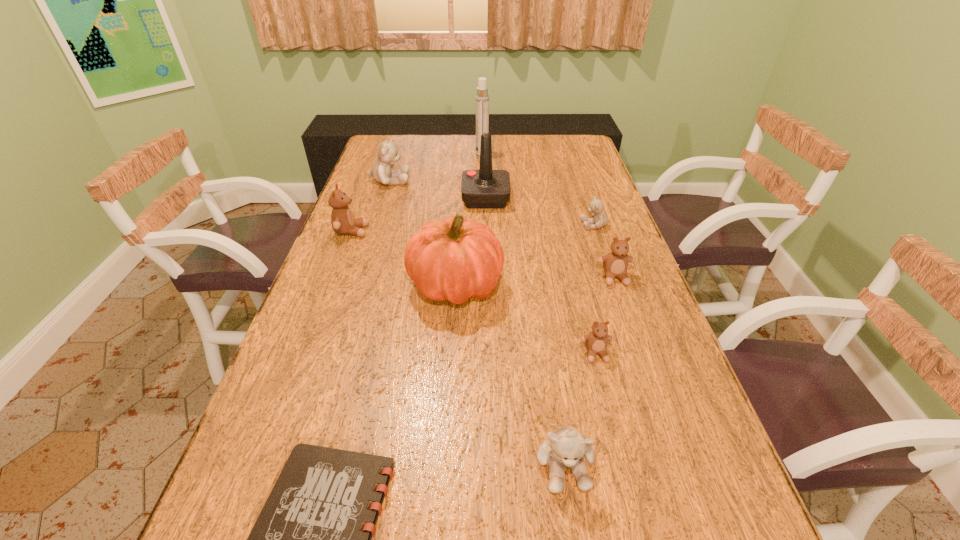
At what (x,y) coordinates should I click in order to perform the action: click on the farthest object. Please return your answer as a coordinate pair (x, y). Looking at the image, I should click on (482, 98).

This screenshot has height=540, width=960. Find the location of `white aerosol can`. white aerosol can is located at coordinates (482, 98).

Where is `joystick`? joystick is located at coordinates (485, 188).

The image size is (960, 540). What are the coordinates of `pumpkin` in the screenshot? It's located at (455, 259).

Image resolution: width=960 pixels, height=540 pixels. What are the coordinates of `the leftmost brown teddy bear` in the screenshot? It's located at (343, 222).

This screenshot has width=960, height=540. I want to click on the farthest brown teddy bear, so click(343, 222).

Identify the location of the farthest gray teddy bear. This screenshot has height=540, width=960. (381, 171).

In order to click on the biggest gray teddy bear in this screenshot , I will do `click(381, 171)`.

Identify the location of the second biggest brown teddy bear. (615, 264).

Find the location of a particular element. The image size is (960, 540). the rightmost brown teddy bear is located at coordinates (615, 264).